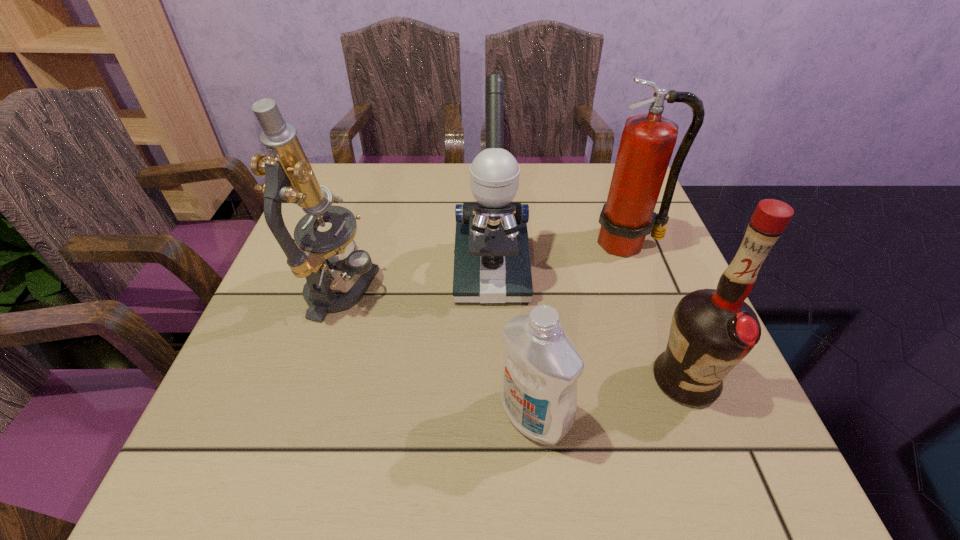
Where is `object at the near edge`? object at the near edge is located at coordinates (541, 365).

Locate an element on the screen. The image size is (960, 540). object that is positioned at the left edge is located at coordinates (315, 255).

This screenshot has height=540, width=960. In order to click on fire extinguisher at the right edge in this screenshot , I will do `click(648, 140)`.

You are a GUI agent. You are given a task and a screenshot of the screen. Output one action in this format:
    pyautogui.click(x=<x>, y=<y>)
    Task: Click on the liquor located at the right edge
    The image size is (960, 540).
    Given the screenshot: What is the action you would take?
    (712, 330)

What are the coordinates of `vacant space at the far edge` in the screenshot? It's located at (392, 198).

Where is `vacant position at the near edge of the desktop`? Image resolution: width=960 pixels, height=540 pixels. vacant position at the near edge of the desktop is located at coordinates (429, 456).

The height and width of the screenshot is (540, 960). I want to click on vacant space at the right edge of the desktop, so click(x=648, y=395).

Locate an element on the screen. The image size is (960, 540). vacant space at the far left corner is located at coordinates (341, 205).

Locate an element on the screen. This screenshot has height=540, width=960. vacant point at the near left corner is located at coordinates (223, 461).

Locate an element on the screen. The image size is (960, 540). vacant space at the far right corner of the desktop is located at coordinates (609, 166).